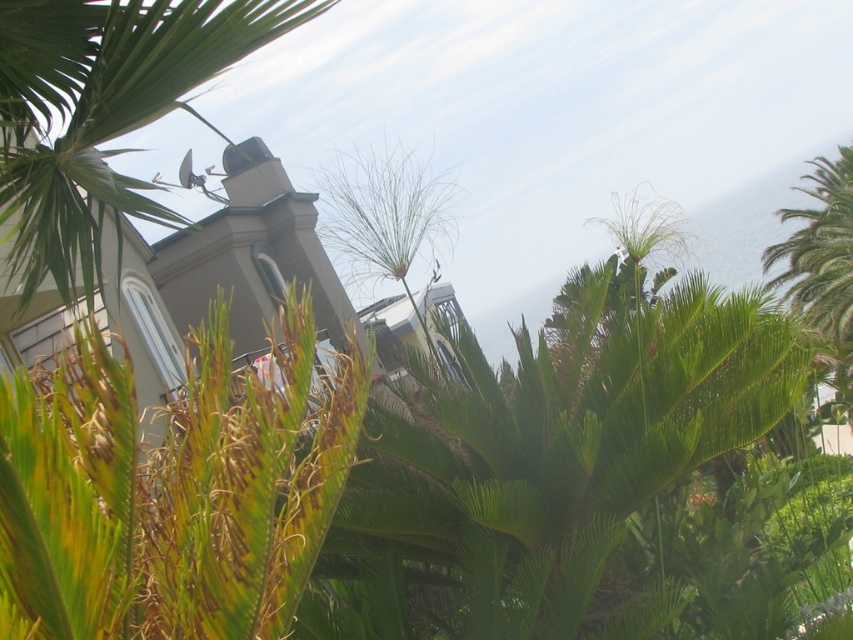
You are standing at point (x=115, y=124) in the coastal scene. What object is located exactly at your current position?

The green leafy palm tree at upper left is located exactly at point (x=115, y=124).

You are standing at the origin point in the coastal scene. There are two points marked in the image. Which point is closer to you, point 1 at coordinates (178, 20) or point 2 at coordinates (833, 323)?

Point 1 at coordinates (178, 20) is closer to you because it is in front of point 2 at coordinates (833, 323).